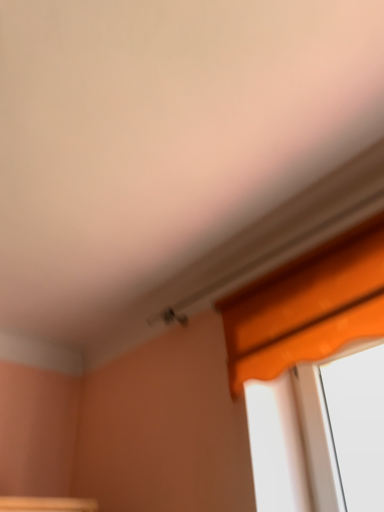
You are a GUI agent. You are given a task and a screenshot of the screen. Output one action in this format:
    pyautogui.click(x=<x>, y=<y>)
    Task: Click on the orange fabric curtain at upper right
    The image size is (384, 512).
    Given the screenshot: What is the action you would take?
    pyautogui.click(x=307, y=308)

What do you see at coordinates (307, 308) in the screenshot?
I see `orange fabric curtain at upper right` at bounding box center [307, 308].

Measure the distance between orange fabric curtain at upper right and camera.

orange fabric curtain at upper right and camera are 3.59 feet apart from each other.

This screenshot has height=512, width=384. What are the coordinates of `orange fabric curtain at upper right` in the screenshot? It's located at (307, 308).